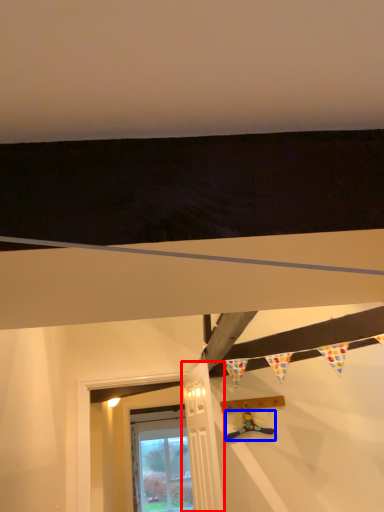
Question: Which point is closer to the camera, door (highlighted by a red box) or toy (highlighted by a blue box)?

Choices:
 (A) door
 (B) toy

Answer: (A)